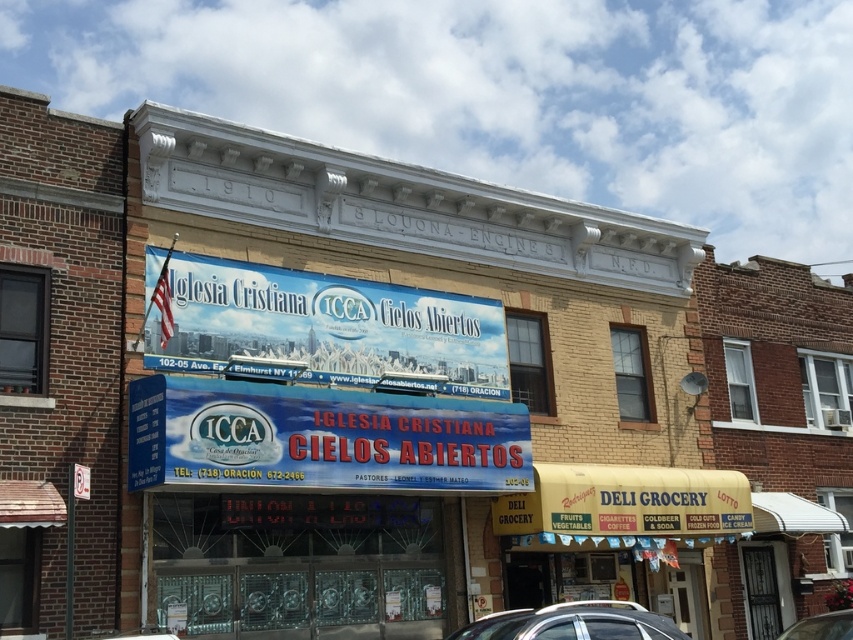
Find the location of a particular element. This screenshot has height=640, width=853. yellow fabric sign at lower right is located at coordinates pyautogui.click(x=625, y=500).

Does yellow fabric sign at lower right have a smaller size compared to metallic silver car at lower right?

Indeed, yellow fabric sign at lower right has a smaller size compared to metallic silver car at lower right.

Describe the element at coordinates (625, 500) in the screenshot. I see `yellow fabric sign at lower right` at that location.

Image resolution: width=853 pixels, height=640 pixels. I want to click on yellow fabric sign at lower right, so click(x=625, y=500).

Looking at this image, which is above, blue fabric banner at center or yellow fabric sign at lower right?

blue fabric banner at center is above.

Does blue fabric banner at center appear under yellow fabric sign at lower right?

Actually, blue fabric banner at center is above yellow fabric sign at lower right.

Based on the photo, who is more forward, [351,316] or [590,481]?

Point [351,316]

Locate an element on the screen. Image resolution: width=853 pixels, height=640 pixels. blue fabric banner at center is located at coordinates (328, 326).

Can you confirm if blue fabric sign at center is taller than yellow fabric sign at lower right?

Yes, blue fabric sign at center is taller than yellow fabric sign at lower right.

Measure the distance between blue fabric sign at center and yellow fabric sign at lower right.

They are 2.97 meters apart.

This screenshot has width=853, height=640. I want to click on blue fabric sign at center, so click(x=320, y=436).

You are a GUI agent. You are given a task and a screenshot of the screen. Output one action in this format:
    pyautogui.click(x=<x>, y=<y>)
    Task: Click on the blue fabric sign at center
    
    Given the screenshot: What is the action you would take?
    pyautogui.click(x=320, y=436)